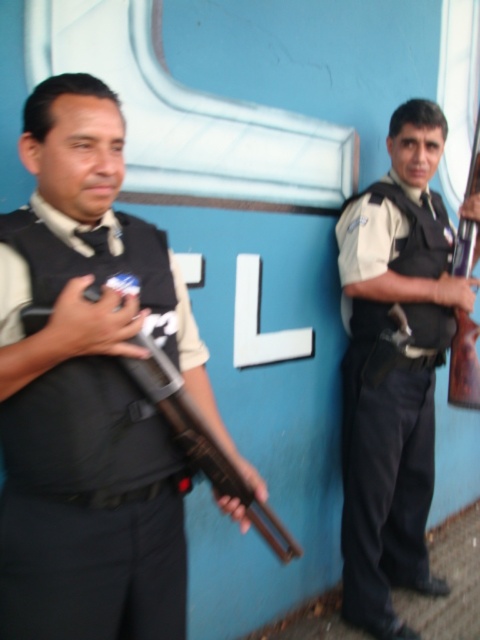
Based on the photo, you are a security supervisor who needs to check the distance between the matte black shotgun at left and the wooden rifle at right. According to the scene, how far apart are these two weapons?

The matte black shotgun at left and the wooden rifle at right are 2.16 meters apart from each other.

From the picture: You are standing at the point with coordinates point (465, 260) and need to move to the point with coordinates point (181, 397). According to the scene, which direction should you move to reach your destination?

You should move forward because point (181, 397) is in front of point (465, 260).